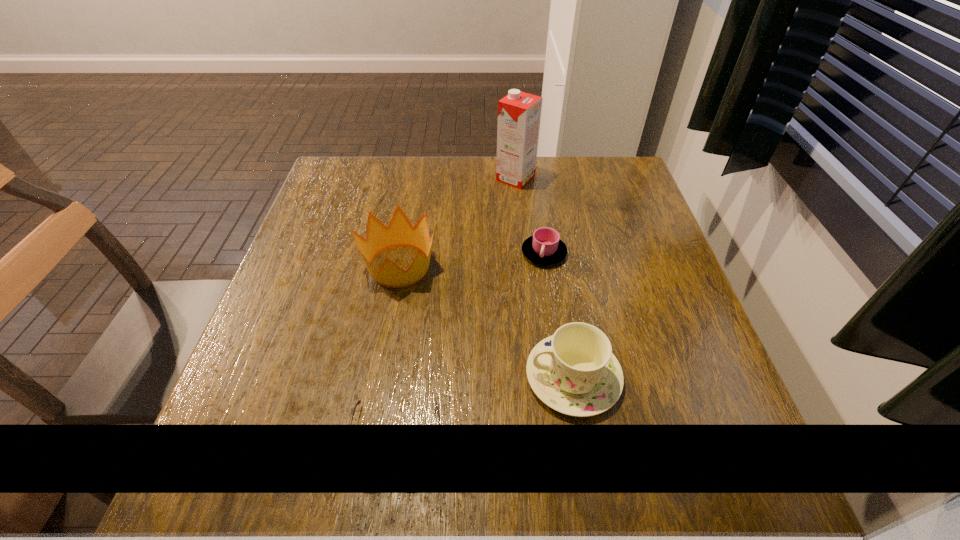
At what (x,y) coordinates should I click in order to perform the action: click on free area in between the chinaware and the cup. Please return your answer as a coordinate pair (x, y). This screenshot has width=960, height=540. Looking at the image, I should click on (559, 315).

Identify the location of object identified as the third closest to the tallest object. (574, 371).

Select which object appears as the second closest to the chinaware. Please provide its 2D coordinates. Your answer should be formatted as a tuple, i.e. [(x, y)], where the tuple contains the x and y coordinates of a point satisfying the conditions above.

[(545, 247)]

You are a GUI agent. You are given a task and a screenshot of the screen. Output one action in this format:
    pyautogui.click(x=<x>, y=<y>)
    Task: Click on the free spot that satisfies the following two spatial constraints: 1. on the back side of the farthest object; 2. on the right side of the crown
    This screenshot has height=540, width=960.
    Given the screenshot: What is the action you would take?
    pyautogui.click(x=416, y=178)